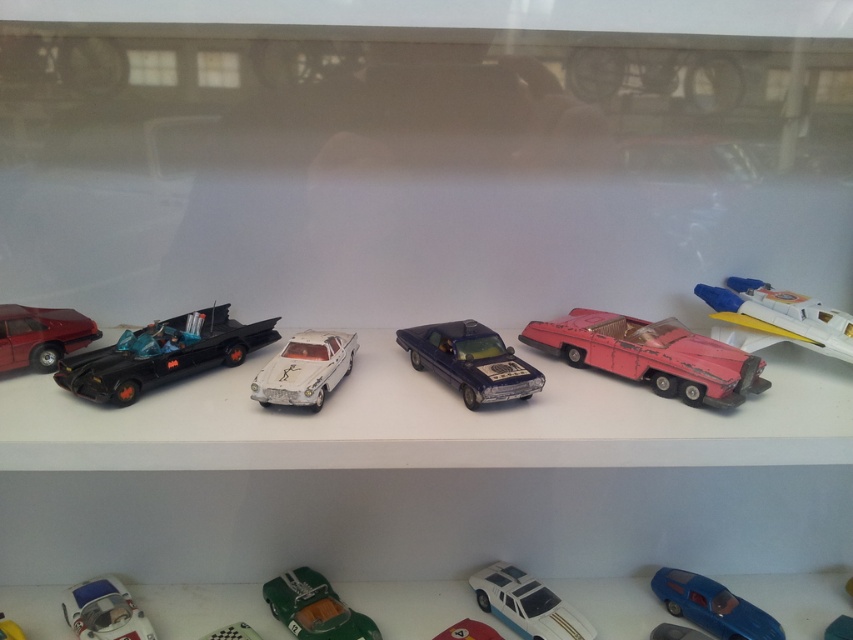
Based on the photo, you are a collector trying to fit a new toy car into the shelf. You have a shiny dark blue car at center and a green glossy toy car at center. Which car requires more space due to its size?

The shiny dark blue car at center requires more space because it has a larger size compared to the green glossy toy car at center.

From the picture: You are organizing a toy shelf and need to place a new toy between the white matte toy car at center and the green glossy toy car at center. Based on their positions, where should the new toy be placed?

The white matte toy car at center is above the green glossy toy car at center, so the new toy should be placed between them vertically, either above the green glossy toy car at center or below the white matte toy car at center to maintain the vertical arrangement.